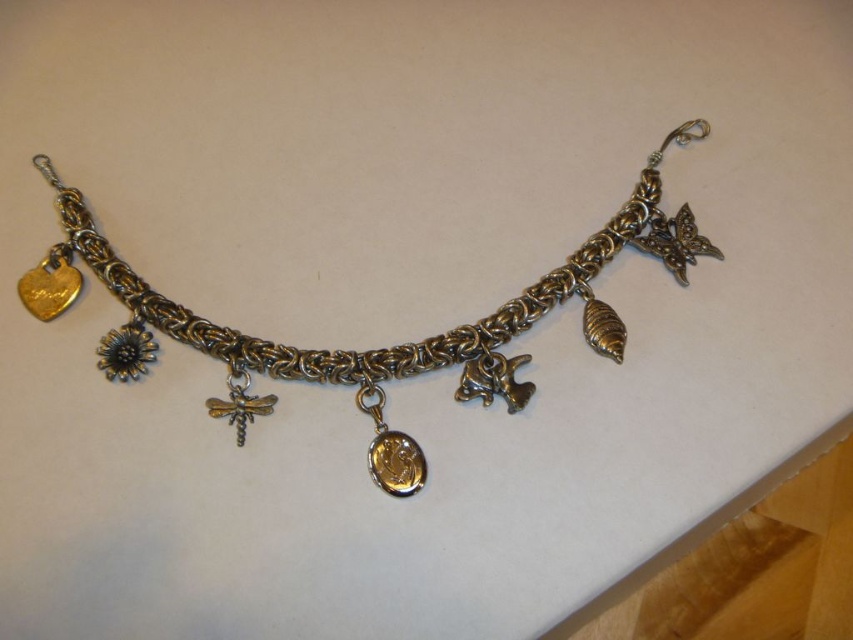
Can you confirm if gold plated medallion at center is smaller than silver metallic dragonfly at center?

Incorrect, gold plated medallion at center is not smaller in size than silver metallic dragonfly at center.

Consider the image. Who is more distant from viewer, (386,436) or (238,426)?

Point (386,436)

Is point (408, 496) more distant than point (238, 396)?

That is False.

Find the location of `gold plated medallion at center`. gold plated medallion at center is located at coordinates (390, 449).

Who is lower down, antique gold chain at center or gold plated medallion at center?

gold plated medallion at center is below.

Does point (606, 244) lie in front of point (368, 387)?

No, (606, 244) is behind (368, 387).

I want to click on antique gold chain at center, so click(x=376, y=348).

Between antique gold chain at center and silver metallic dragonfly at center, which one is positioned higher?

antique gold chain at center

Is antique gold chain at center thinner than silver metallic dragonfly at center?

No, antique gold chain at center is not thinner than silver metallic dragonfly at center.

Which is behind, point (595, 337) or point (236, 410)?

The point (595, 337) is more distant.

This screenshot has height=640, width=853. I want to click on antique gold chain at center, so click(x=376, y=348).